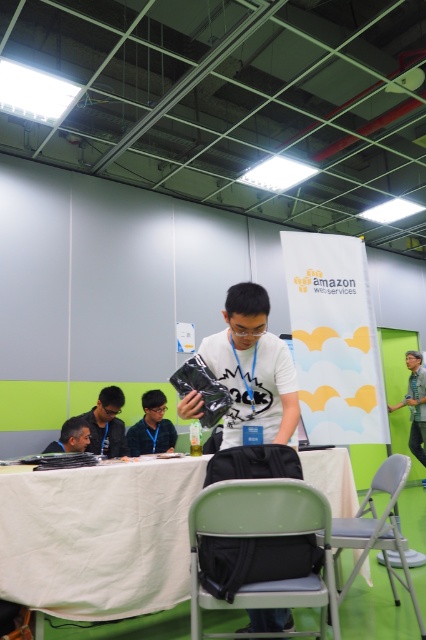
You are a visitor at the conference hall and want to place a 5.5 feet long banner between the white fabric table at center and the matte black laptop at left. Will the banner fit in the space between them?

The distance between the white fabric table at center and the matte black laptop at left is 5.76 feet, which is slightly longer than the 5.5 feet banner. Therefore, the banner will fit comfortably in the space between them.

You are organizing a small event and need to seat two people at a table. You have a green fabric chair at lower center and a gray fabric chair at lower center available. Which chair would allow for more space between the seated guests?

The gray fabric chair at lower center has a greater width than the green fabric chair at lower center, so using the gray fabric chair at lower center would provide more space between the seated guests.